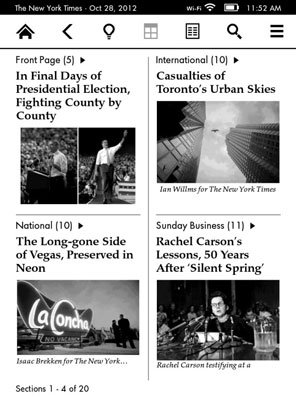
The image size is (296, 400). I want to click on pitcher, so click(269, 338).